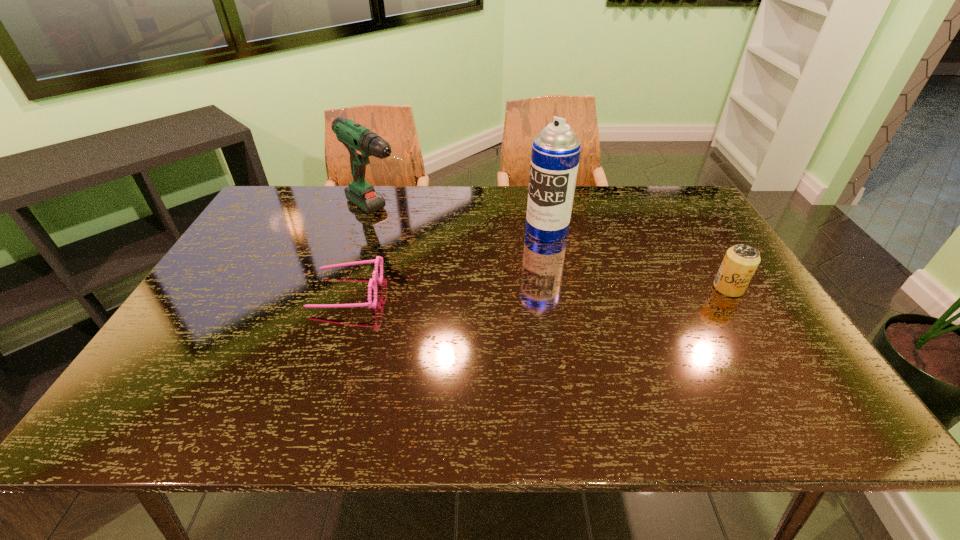
The height and width of the screenshot is (540, 960). In the image, there is a desktop. Find the location of `vacant space at the near edge`. vacant space at the near edge is located at coordinates (437, 362).

The image size is (960, 540). What are the coordinates of `free space at the left edge of the desktop` in the screenshot? It's located at (290, 232).

In the image, there is a desktop. What are the coordinates of `free space at the right edge` in the screenshot? It's located at (701, 258).

Locate an element on the screen. This screenshot has width=960, height=540. free space at the far left corner of the desktop is located at coordinates (276, 192).

Locate an element on the screen. This screenshot has width=960, height=540. vacant space at the near left corner of the desktop is located at coordinates (174, 377).

I want to click on free space between the tallest object and the shortest object, so click(x=446, y=261).

Where is `free space between the spectacles and the aerosol can`? The width and height of the screenshot is (960, 540). free space between the spectacles and the aerosol can is located at coordinates (446, 261).

Identify the location of unoccupied area between the spectacles and the third shortest object. (363, 253).

Locate an element on the screen. Image resolution: width=960 pixels, height=540 pixels. unoccupied area between the third shortest object and the third tallest object is located at coordinates (554, 251).

Locate an element on the screen. The width and height of the screenshot is (960, 540). free point between the second object from right to left and the third shortest object is located at coordinates (463, 222).